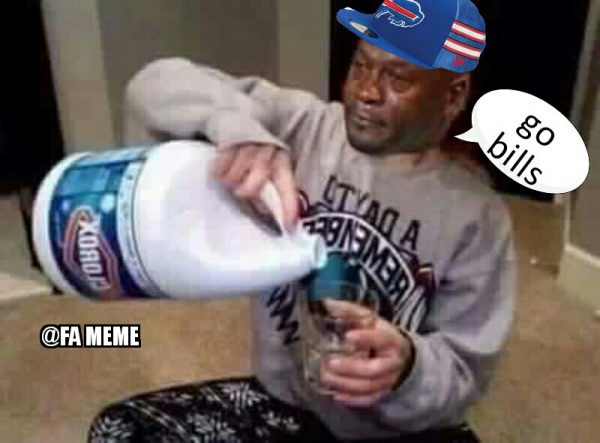
The height and width of the screenshot is (443, 600). I want to click on walls, so click(x=104, y=25), click(x=586, y=214).